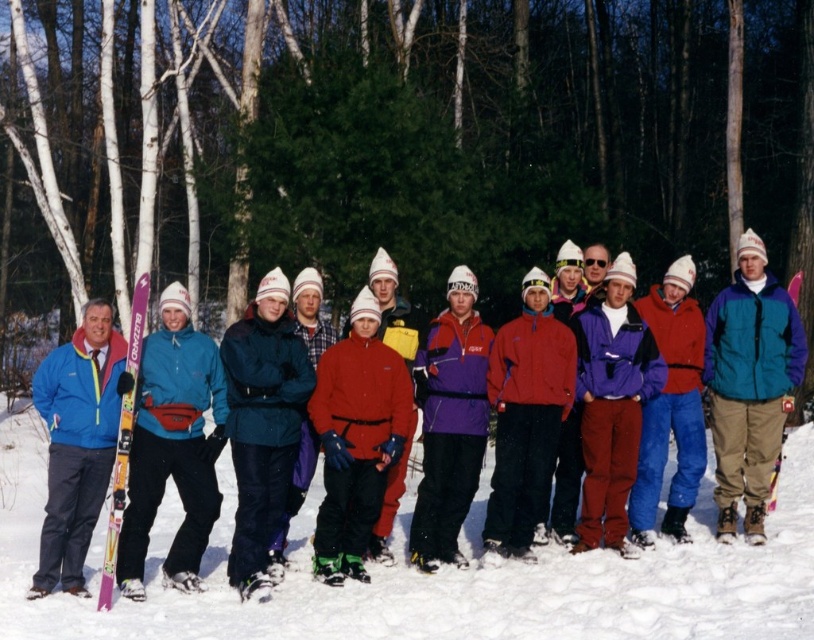
Does point (300, 456) come closer to viewer compared to point (793, 275)?

Yes, point (300, 456) is in front of point (793, 275).

Is blue fleece jacket at center to the left of pink plastic ski at center from the viewer's perspective?

Yes, blue fleece jacket at center is to the left of pink plastic ski at center.

Who is more forward, (616, 289) or (769, 508)?

Point (616, 289) is more forward.

Locate an element on the screen. This screenshot has width=814, height=640. blue fleece jacket at center is located at coordinates (116, 497).

Who is taller, pink matte skis at left or pink plastic ski at center?

pink plastic ski at center

Is point (130, 330) positioned behind point (801, 276)?

No, it is not.

Is point (125, 460) closer to camera compared to point (791, 408)?

Yes, point (125, 460) is in front of point (791, 408).

Where is `pink matte skis at left`? The width and height of the screenshot is (814, 640). pink matte skis at left is located at coordinates (123, 438).

Is point (674, 609) behind point (114, 518)?

No, it is not.

Who is higher up, white powder snow at center or pink matte skis at left?

Positioned higher is pink matte skis at left.

This screenshot has height=640, width=814. I want to click on white powder snow at center, so click(436, 577).